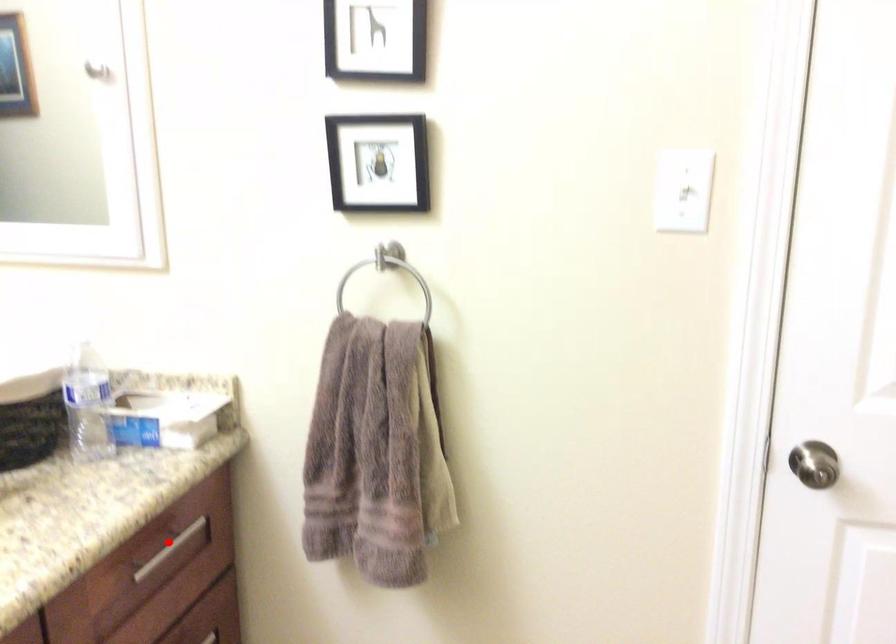
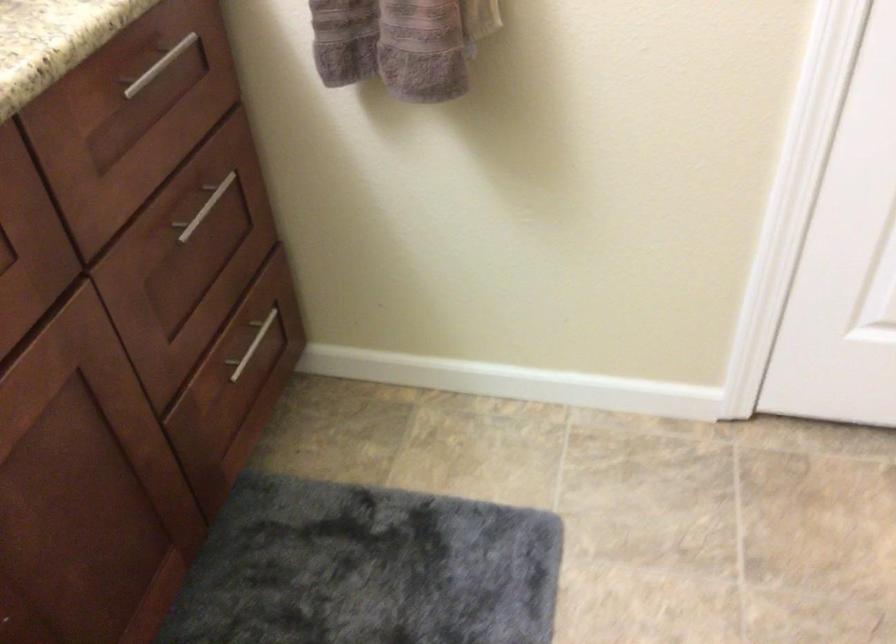
Question: I am providing you with two images of the same scene from different viewpoints. In image1, a red point is highlighted. Considering the same 3D point in image2, which of the following is correct?

Choices:
 (A) It is closer
 (B) It is farther

Answer: (A)